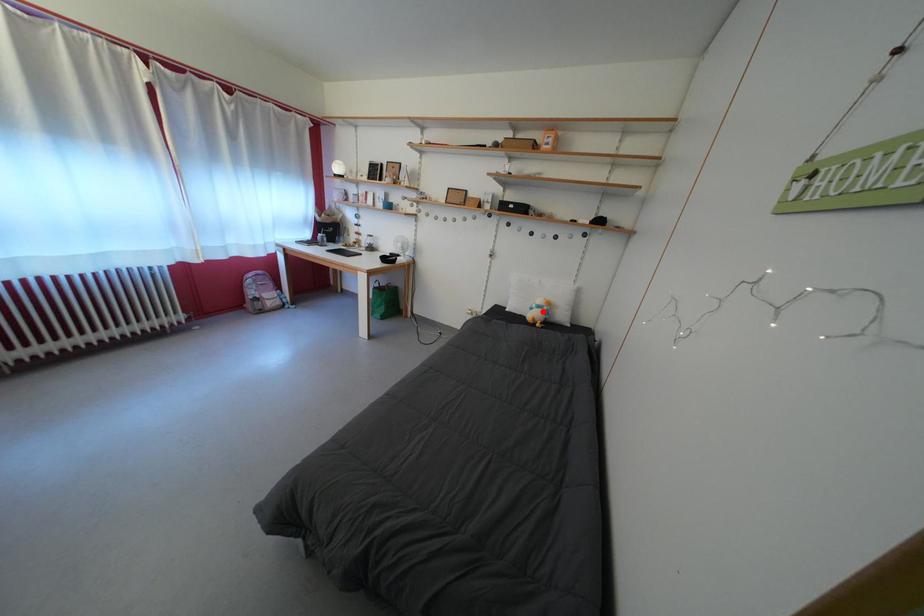
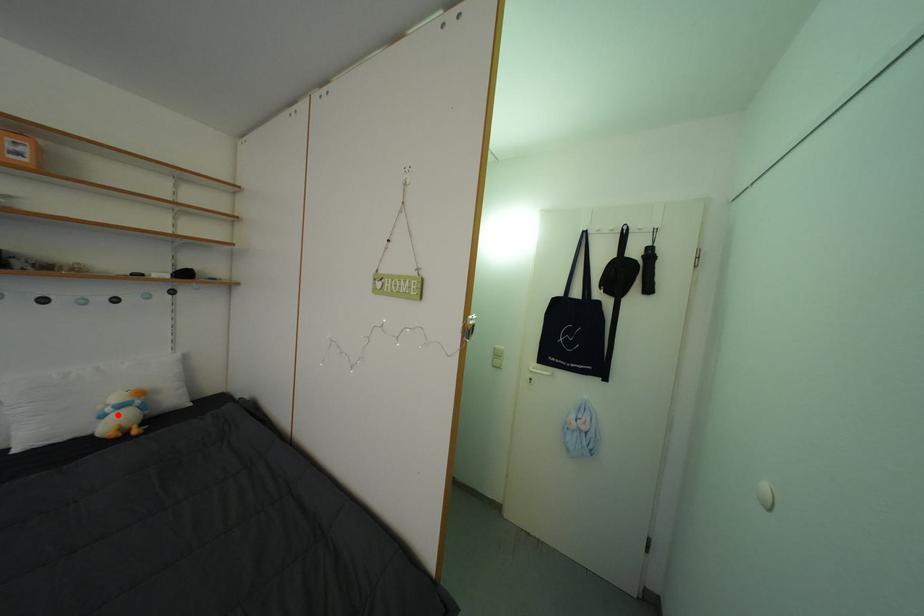
From the picture: I am providing you with two images of the same scene from different viewpoints. A red point is marked on the first image and another point is marked on the second image. Is the red point in image1 aligned with the point shown in image2?

Yes